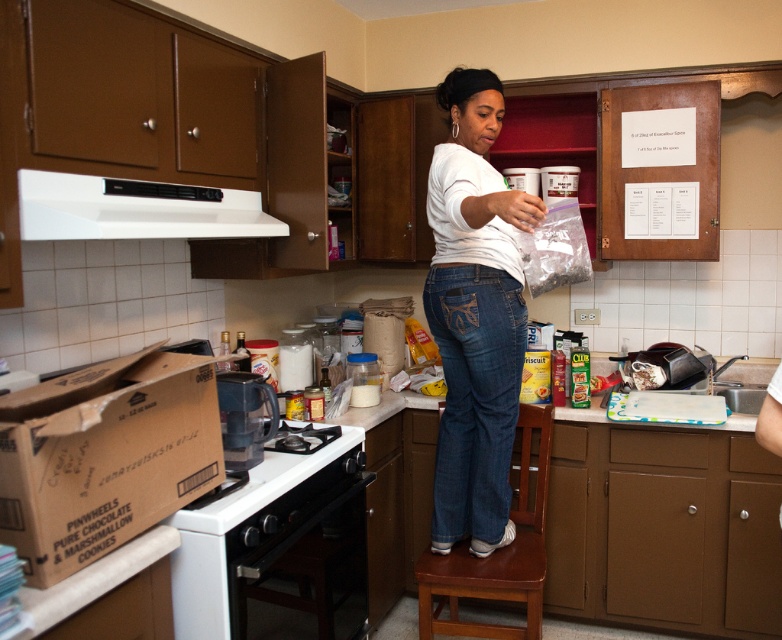
Who is taller, brown cardboard box at lower left or brown wooden step stool at center?

With more height is brown wooden step stool at center.

Who is positioned more to the left, brown cardboard box at lower left or brown wooden step stool at center?

Positioned to the left is brown cardboard box at lower left.

I want to click on brown cardboard box at lower left, so click(103, 456).

You are a GUI agent. You are given a task and a screenshot of the screen. Output one action in this format:
    pyautogui.click(x=<x>, y=<y>)
    Task: Click on the brown cardboard box at lower left
    
    Given the screenshot: What is the action you would take?
    pyautogui.click(x=103, y=456)

Which is more to the left, white cotton shirt at center or white matte exhaust hood at upper center?

white matte exhaust hood at upper center is more to the left.

Does point (465, 356) come behind point (232, 232)?

Yes, point (465, 356) is farther from viewer.

Locate an element on the screen. The width and height of the screenshot is (782, 640). white cotton shirt at center is located at coordinates (475, 316).

Is brown cardboard box at lower left positioned in front of white matte exhaust hood at upper center?

Yes, it is in front of white matte exhaust hood at upper center.

Does brown cardboard box at lower left have a lesser width compared to white matte exhaust hood at upper center?

Yes.

What do you see at coordinates (103, 456) in the screenshot? The height and width of the screenshot is (640, 782). I see `brown cardboard box at lower left` at bounding box center [103, 456].

This screenshot has width=782, height=640. What are the coordinates of `brown cardboard box at lower left` in the screenshot? It's located at (103, 456).